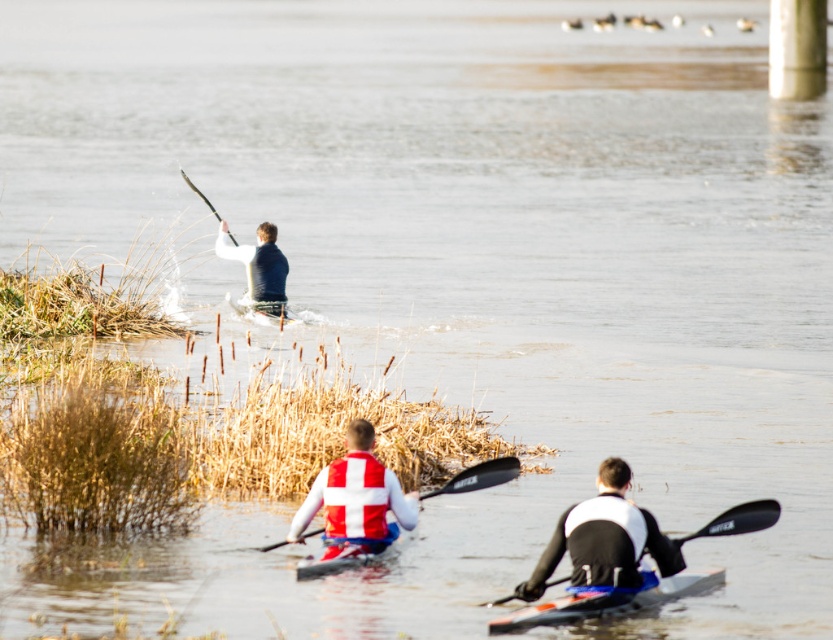
You are a photographer trying to capture a clear shot of the white matte life jacket at center and the black plastic paddle at center. Since you want to focus on the life jacket, which object should you adjust your camera lens to prioritize in terms of size in the frame?

The white matte life jacket at center is taller than the black plastic paddle at center, so you should adjust your camera lens to prioritize the white matte life jacket at center as it already appears larger in the frame.

You are a photographer positioned at the camera. You want to capture a photo of the kayaker at point (367,513) and the kayaker at point (487,605). Which kayaker will appear closer to the camera in the photo?

The kayaker at point (367,513) will appear closer to the camera in the photo because point (367,513) is further to the camera than point (487,605).